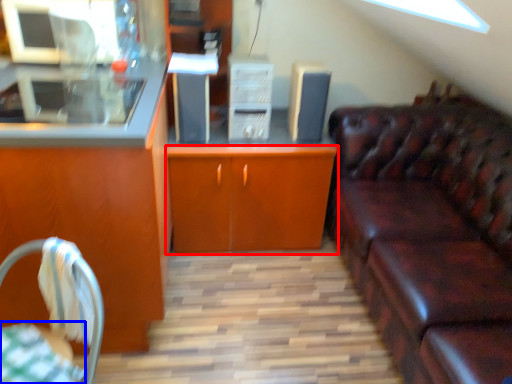
Question: Which object appears farthest to the camera in this image, cabinetry (highlighted by a red box) or tablecloth (highlighted by a blue box)?

Choices:
 (A) cabinetry
 (B) tablecloth

Answer: (A)